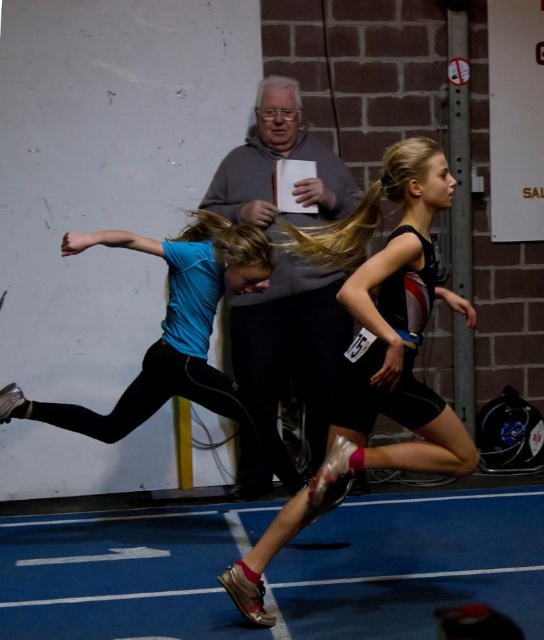
Question: Which point appears farthest from the camera in this image?

Choices:
 (A) (347, 205)
 (B) (327, 502)
 (C) (251, 234)

Answer: (A)

Question: Which point is farther from the camera taking this photo?

Choices:
 (A) pyautogui.click(x=381, y=346)
 (B) pyautogui.click(x=287, y=86)

Answer: (B)

Question: Based on their relative distances, which object is farther from the blue matte running suit at center?

Choices:
 (A) gray matte jacket at center
 (B) black matte running suit at center

Answer: (A)

Question: Is gray matte jacket at center closer to camera compared to blue matte running suit at center?

Choices:
 (A) yes
 (B) no

Answer: (B)

Question: Can you confirm if black matte running suit at center is positioned to the right of gray matte jacket at center?

Choices:
 (A) yes
 (B) no

Answer: (A)

Question: Can you confirm if gray matte jacket at center is positioned above blue matte running suit at center?

Choices:
 (A) no
 (B) yes

Answer: (B)